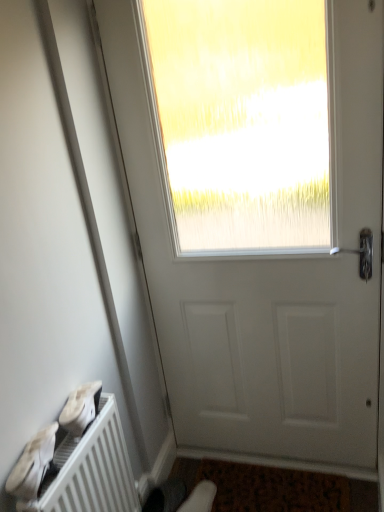
Question: Should I look upward or downward to see white matte door at center?

Choices:
 (A) up
 (B) down

Answer: (B)

Question: From a real-world perspective, is brown textured mat at lower center on top of white matte shoe at lower left, the 1th shoe from the left?

Choices:
 (A) no
 (B) yes

Answer: (A)

Question: Considering the relative sizes of brown textured mat at lower center and white matte shoe at lower left, the 3th shoe from the back, in the image provided, is brown textured mat at lower center smaller than white matte shoe at lower left, the 3th shoe from the back,?

Choices:
 (A) yes
 (B) no

Answer: (B)

Question: Does brown textured mat at lower center turn towards white matte shoe at lower left, the 3th shoe from the back?

Choices:
 (A) no
 (B) yes

Answer: (A)

Question: Is brown textured mat at lower center with white matte shoe at lower left, the 2th shoe from the bottom?

Choices:
 (A) no
 (B) yes

Answer: (A)

Question: Is brown textured mat at lower center in front of white matte shoe at lower left, marked as the 1th shoe in a front-to-back arrangement?

Choices:
 (A) yes
 (B) no

Answer: (B)

Question: Is the position of brown textured mat at lower center more distant than that of white matte shoe at lower left, the 2th shoe from the bottom?

Choices:
 (A) yes
 (B) no

Answer: (A)

Question: Does white matte shoe at lower left, which is the second shoe from back to front, have a smaller size compared to white suede shoe at lower center, the third shoe from the top?

Choices:
 (A) yes
 (B) no

Answer: (A)

Question: Is white matte shoe at lower left, which ranks as the 2th shoe in front-to-back order, to the left of white suede shoe at lower center, the 1th shoe from the bottom, from the viewer's perspective?

Choices:
 (A) yes
 (B) no

Answer: (A)

Question: Can you confirm if white matte shoe at lower left, the third shoe when ordered from bottom to top, is positioned to the right of white suede shoe at lower center, the 3th shoe in the front-to-back sequence?

Choices:
 (A) no
 (B) yes

Answer: (A)

Question: Is white matte shoe at lower left, the third shoe when ordered from bottom to top, looking in the opposite direction of white suede shoe at lower center, the third shoe from the top?

Choices:
 (A) yes
 (B) no

Answer: (B)

Question: Is white matte shoe at lower left, marked as the first shoe in a top-to-bottom arrangement, taller than white suede shoe at lower center, which appears as the third shoe when viewed from the left?

Choices:
 (A) no
 (B) yes

Answer: (B)

Question: Are white matte shoe at lower left, marked as the first shoe in a top-to-bottom arrangement, and white suede shoe at lower center, which appears as the third shoe when viewed from the left, located far from each other?

Choices:
 (A) no
 (B) yes

Answer: (A)

Question: Does white matte shoe at lower left, positioned as the second shoe in right-to-left order, have a lesser height compared to white matte door at center?

Choices:
 (A) yes
 (B) no

Answer: (A)